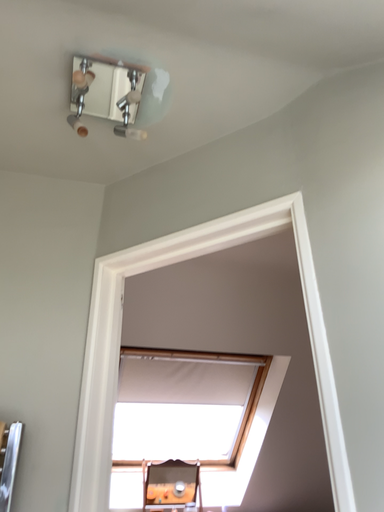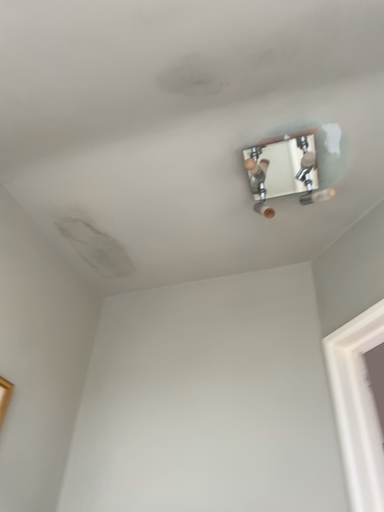
Question: Which way did the camera rotate in the video?

Choices:
 (A) rotated downward
 (B) rotated upward

Answer: (B)